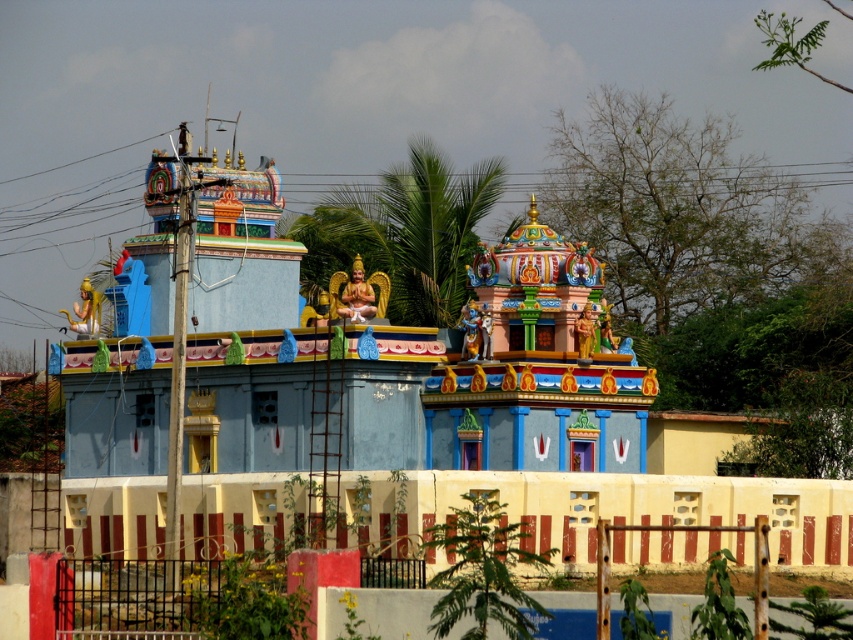
You are an architect visiting the temple and need to determine the placement of a new decorative element. Based on the existing golden statues, which one is wider? The golden statue at upper left or the golden statue at center?

The golden statue at upper left might be wider than golden statue at center.